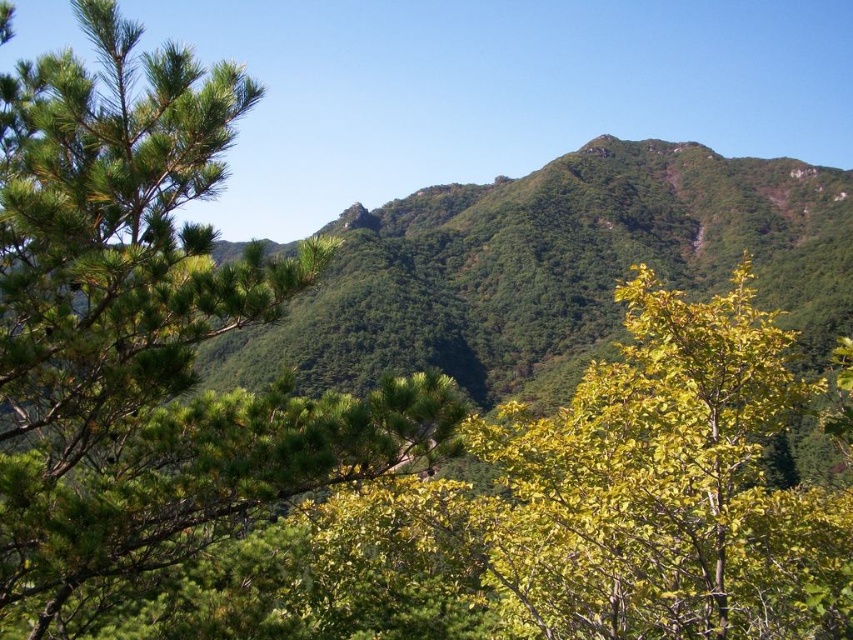
Consider the image. Can you confirm if green matte tree at left is bigger than green leafy tree at center?

Actually, green matte tree at left might be smaller than green leafy tree at center.

Who is shorter, green matte tree at left or green leafy tree at center?

Standing shorter between the two is green leafy tree at center.

Identify the location of green matte tree at left. (148, 339).